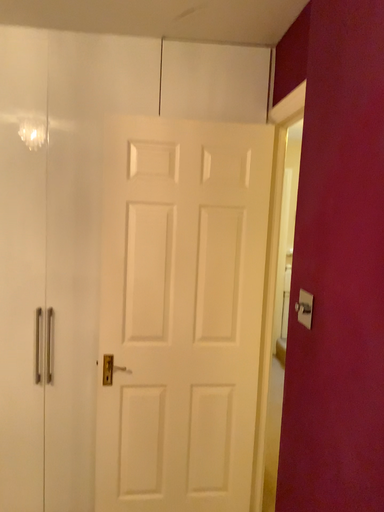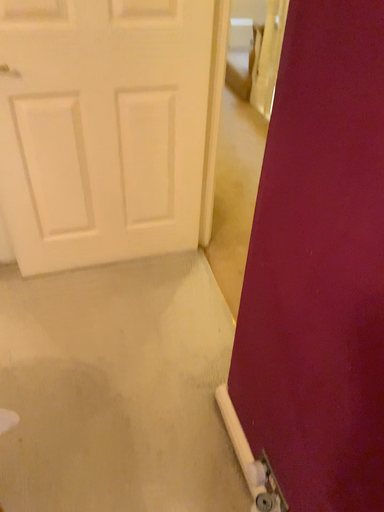
Question: How did the camera likely rotate when shooting the video?

Choices:
 (A) rotated downward
 (B) rotated upward

Answer: (A)